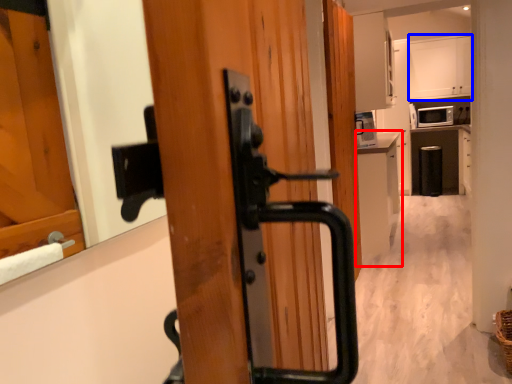
Question: Which of the following is the farthest to the observer, cabinetry (highlighted by a red box) or cabinetry (highlighted by a blue box)?

Choices:
 (A) cabinetry
 (B) cabinetry

Answer: (B)